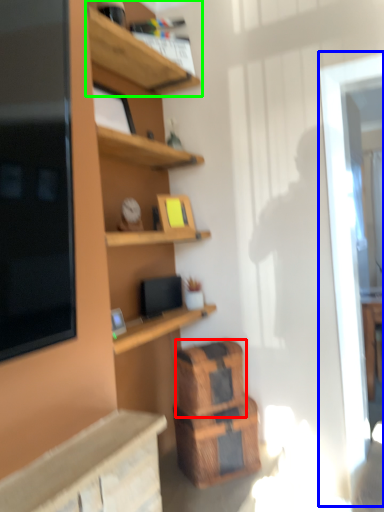
Question: Which object is the farthest from crate (highlighted by a red box)? Choose among these: glass door (highlighted by a blue box) or shelf (highlighted by a green box).

Choices:
 (A) glass door
 (B) shelf

Answer: (B)